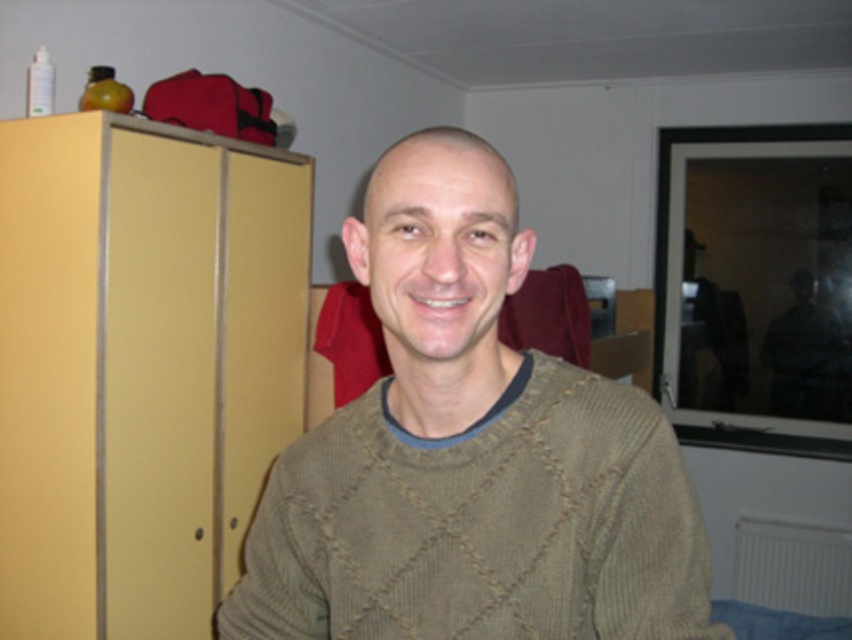
Is knitted olive sweater at center wider than matte yellow cabinet at left?

In fact, knitted olive sweater at center might be narrower than matte yellow cabinet at left.

Who is higher up, knitted olive sweater at center or matte yellow cabinet at left?

matte yellow cabinet at left is above.

Which is in front, point (415, 458) or point (202, 304)?

Point (415, 458) is in front.

I want to click on knitted olive sweater at center, so pyautogui.click(x=470, y=454).